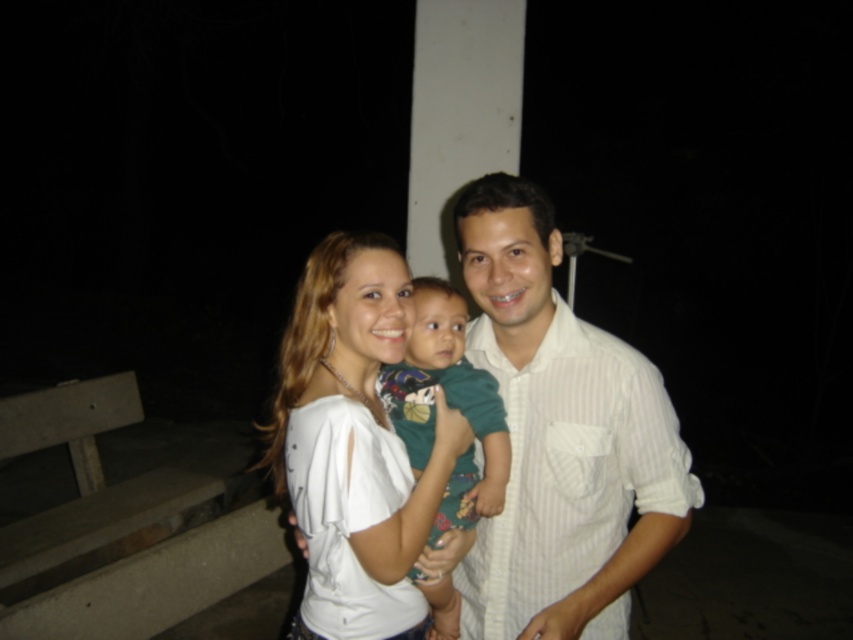
Question: Does white cotton shirt at center have a larger size compared to green fabric shirt at center?

Choices:
 (A) no
 (B) yes

Answer: (B)

Question: Which object is positioned farthest from the green fabric shirt at center?

Choices:
 (A) white cotton shirt at center
 (B) white striped shirt at center

Answer: (B)

Question: Does white cotton shirt at center have a lesser width compared to green fabric shirt at center?

Choices:
 (A) yes
 (B) no

Answer: (B)

Question: Which point is closer to the camera?

Choices:
 (A) (473, 400)
 (B) (567, 323)
 (C) (368, 493)

Answer: (C)

Question: Which of these objects is positioned farthest from the white cotton shirt at center?

Choices:
 (A) white striped shirt at center
 (B) green fabric shirt at center

Answer: (A)

Question: Is white striped shirt at center positioned in front of green fabric shirt at center?

Choices:
 (A) yes
 (B) no

Answer: (A)